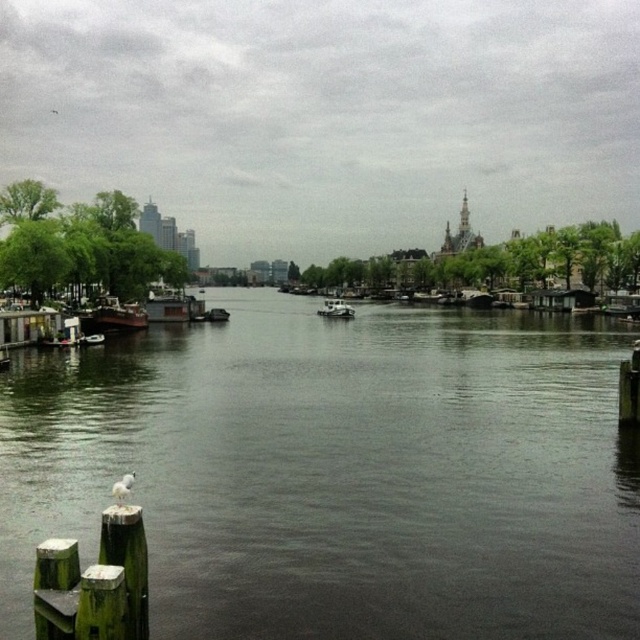
From the picture: Does dark gray water at center appear on the left side of white matte boat at center?

Yes, dark gray water at center is to the left of white matte boat at center.

Does dark gray water at center appear under white matte boat at center?

Yes.

Is point (499, 365) farther from camera compared to point (330, 304)?

No, (499, 365) is in front of (330, 304).

The height and width of the screenshot is (640, 640). I want to click on dark gray water at center, so click(x=339, y=472).

Which is more to the right, wooden houseboat at left or white matte boat at center?

white matte boat at center

Who is more distant from viewer, (109, 298) or (336, 301)?

The point (336, 301) is more distant.

Who is more distant from viewer, (134,330) or (337,307)?

Positioned behind is point (337,307).

The width and height of the screenshot is (640, 640). Find the location of `wooden houseboat at left`. wooden houseboat at left is located at coordinates (113, 316).

Who is more distant from viewer, (595, 317) or (140, 314)?

The point (595, 317) is behind.

Looking at this image, is dark gray water at center positioned behind wooden houseboat at left?

No.

This screenshot has height=640, width=640. What do you see at coordinates (339, 472) in the screenshot? I see `dark gray water at center` at bounding box center [339, 472].

Locate an element on the screen. This screenshot has width=640, height=640. dark gray water at center is located at coordinates (339, 472).